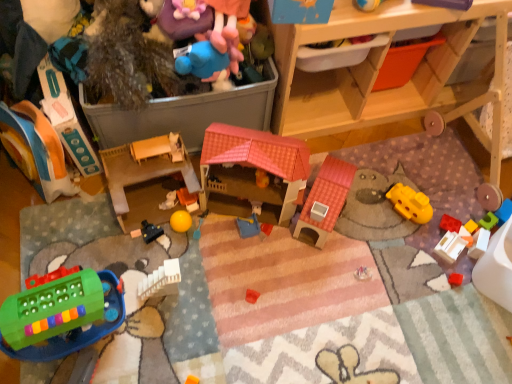
At what (x,y) coordinates should I click in order to perform the action: click on free space in front of translucent plastic cube at center, which is counted as the 13th toy, starting from the left. Please return your answer as a coordinate pair (x, y). This screenshot has height=384, width=512. Looking at the image, I should click on (458, 274).